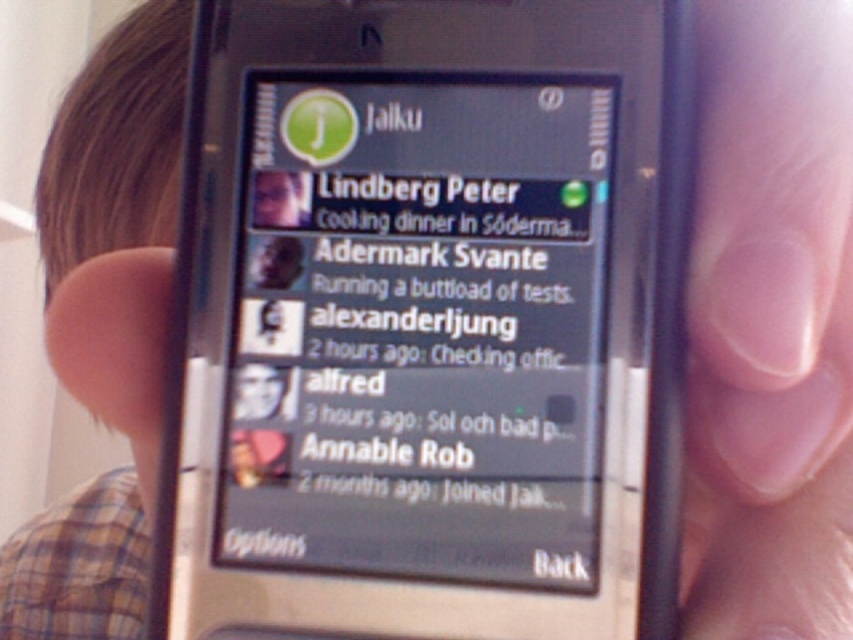
Who is lower down, matte black phone screen at center or matte black phone at center?

matte black phone at center is below.

Between matte black phone screen at center and matte black phone at center, which one appears on the left side from the viewer's perspective?

matte black phone screen at center

Is point (286, 310) in front of point (376, 310)?

No, it is behind (376, 310).

Where is `matte black phone screen at center`? The width and height of the screenshot is (853, 640). matte black phone screen at center is located at coordinates (419, 326).